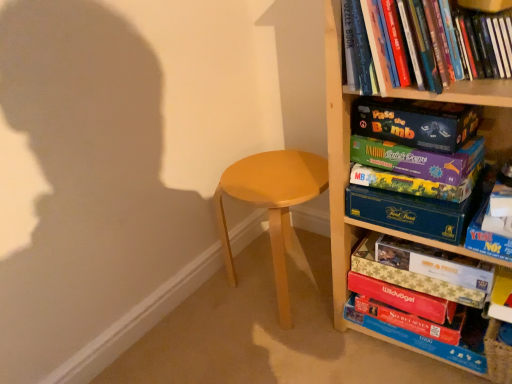
Question: In the image, is wooden bookcase at right positioned in front of or behind red matte board game at lower right, which appears as the second paperback book when ordered from the bottom?

Choices:
 (A) behind
 (B) front

Answer: (B)

Question: Is wooden bookcase at right wider or thinner than red matte board game at lower right, the 6th paperback book from the top?

Choices:
 (A) wide
 (B) thin

Answer: (A)

Question: Which object is positioned farthest from the blue cardboard game box at center-right, placed as the 4th paperback book when sorted from top to bottom?

Choices:
 (A) red matte board game at lower right, the 6th paperback book from the top
 (B) hardcover book at upper right, the second book in the top-to-bottom sequence
 (C) light brown wood stool at center
 (D) gold foil puzzle box at lower right, the fifth paperback book in the top-to-bottom sequence
 (E) wooden bookcase at right

Answer: (B)

Question: Based on their relative distances, which object is nearer to the red matte board game at lower right, acting as the first paperback book starting from the bottom?

Choices:
 (A) hardcover book at upper right, the second book in the top-to-bottom sequence
 (B) matte purple board game at center-right, which appears as the third paperback book when viewed from the top
 (C) blue cardboard game box at center-right, the fourth paperback book positioned from the bottom
 (D) matte purple board game at upper right, the 6th paperback book when ordered from bottom to top
 (E) light brown wood stool at center

Answer: (C)